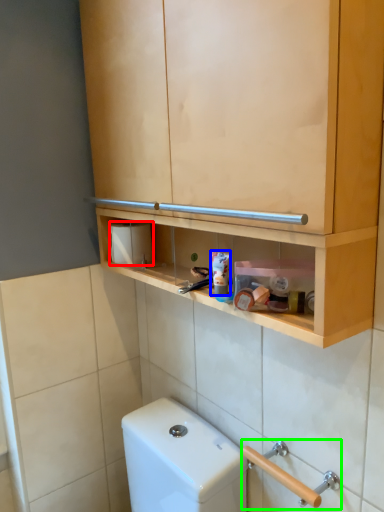
Question: Considering the real-world distances, which object is closest to toilet paper (highlighted by a red box)? toothpaste (highlighted by a blue box) or door handle (highlighted by a green box).

Choices:
 (A) toothpaste
 (B) door handle

Answer: (A)